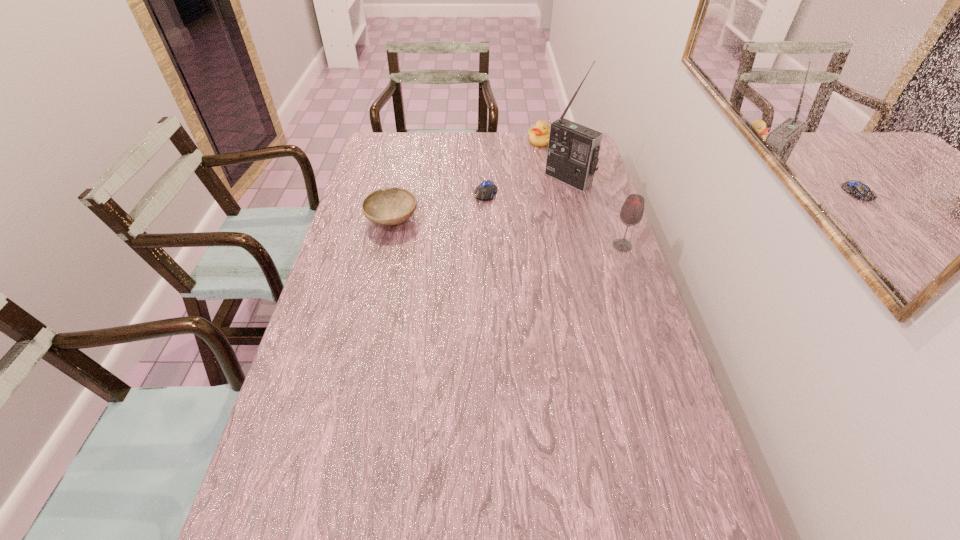
The image size is (960, 540). What are the coordinates of `free spot on the desktop that is between the fourth tallest object and the nearest object and is positioned on the display of the radio receiver` in the screenshot? It's located at (497, 231).

Where is `free space on the desktop that is between the second shortest object and the glass drink container and is positioned on the front-facing side of the farthest object`? This screenshot has width=960, height=540. free space on the desktop that is between the second shortest object and the glass drink container and is positioned on the front-facing side of the farthest object is located at coordinates (501, 232).

Locate an element on the screen. Image resolution: width=960 pixels, height=540 pixels. free space on the desktop that is between the fourth tallest object and the fourth shortest object and is positioned on the button side of the shortest object is located at coordinates (472, 228).